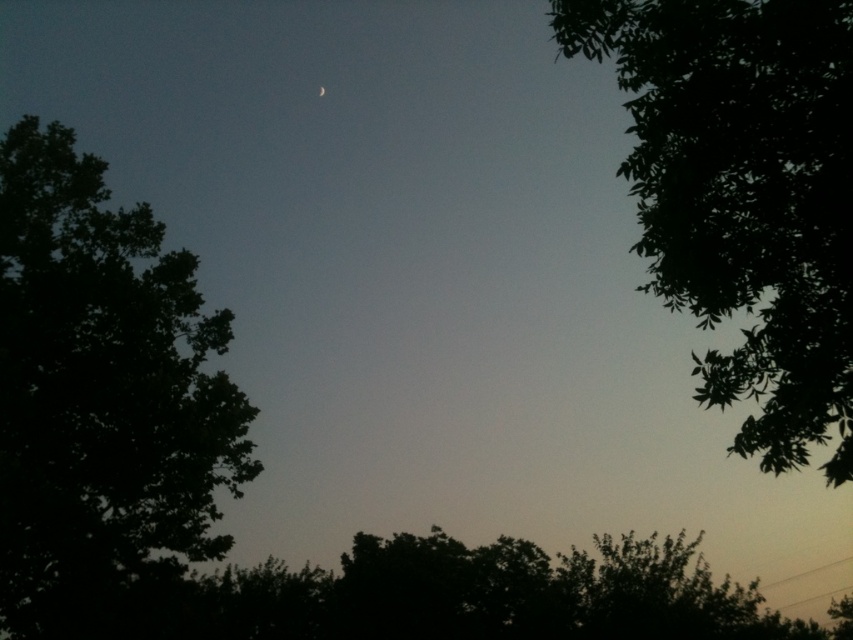
Question: Which point is farther to the camera?

Choices:
 (A) (318, 88)
 (B) (816, 67)
 (C) (115, 532)

Answer: (A)

Question: In this image, where is dark green leafy tree at left located relative to green leafy tree at upper right?

Choices:
 (A) right
 (B) left

Answer: (B)

Question: Can you confirm if green leafy tree at upper right is positioned above silver metallic moon at upper center?

Choices:
 (A) no
 (B) yes

Answer: (A)

Question: Which is nearer to the dark green leafy tree at left?

Choices:
 (A) green leafy tree at upper right
 (B) silver metallic moon at upper center

Answer: (A)

Question: Is dark green leafy tree at left to the left of silver metallic moon at upper center from the viewer's perspective?

Choices:
 (A) no
 (B) yes

Answer: (B)

Question: Which point appears closest to the camera in this image?

Choices:
 (A) (25, 560)
 (B) (747, 54)
 (C) (322, 90)

Answer: (B)